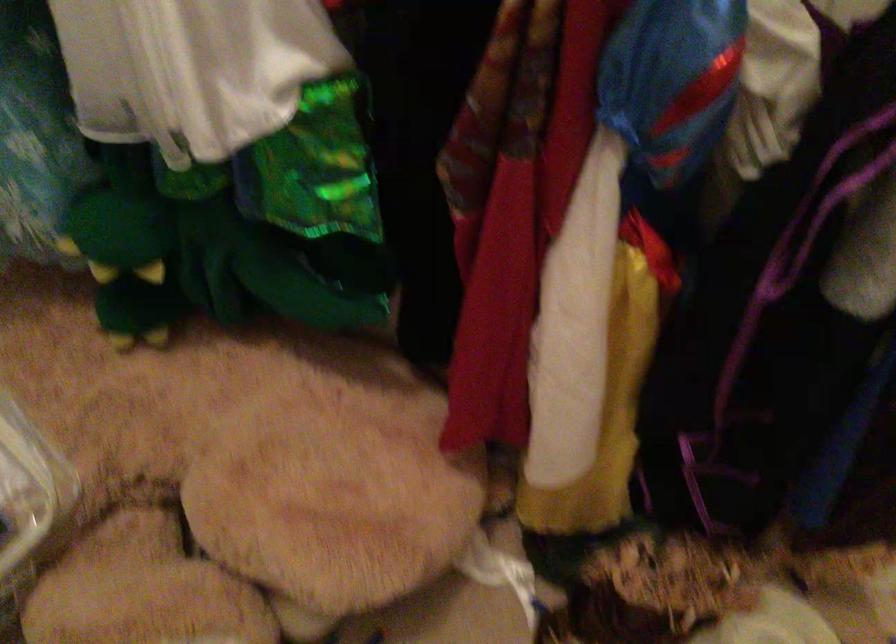
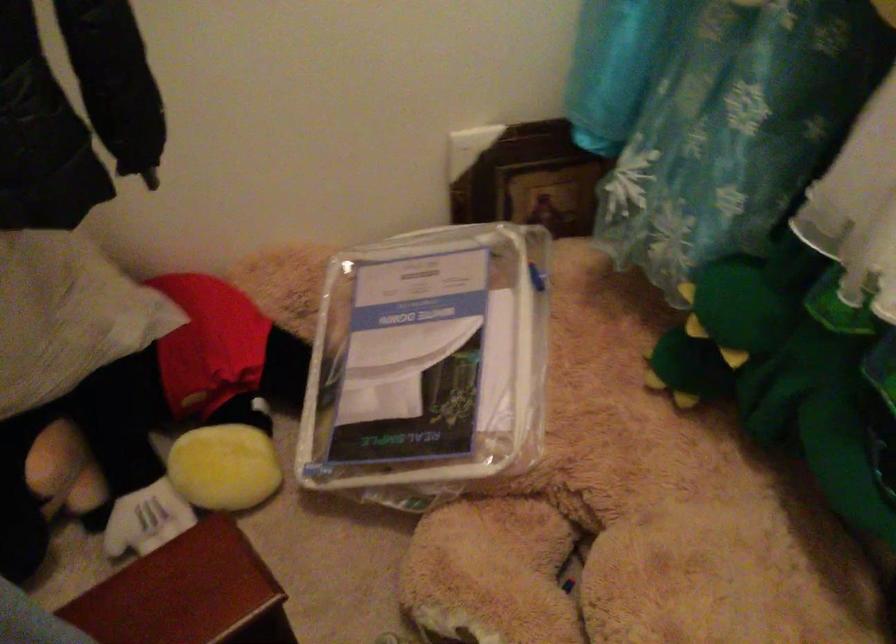
Locate, in the second image, the point that corresponds to point 123,257 in the first image.

(719, 330)